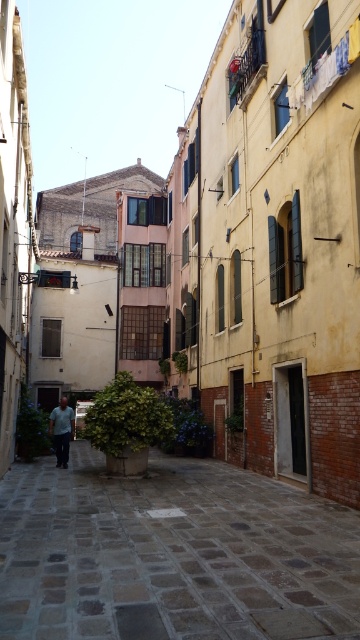
Question: Is stone paved path at center closer to camera compared to light green shirt at center?

Choices:
 (A) yes
 (B) no

Answer: (A)

Question: Which object appears closest to the camera in this image?

Choices:
 (A) stone paved path at center
 (B) light green shirt at center

Answer: (A)

Question: Which point is farther to the camera?

Choices:
 (A) light green shirt at center
 (B) stone paved path at center

Answer: (A)

Question: Is stone paved path at center bigger than light green shirt at center?

Choices:
 (A) no
 (B) yes

Answer: (A)

Question: Does stone paved path at center appear over light green shirt at center?

Choices:
 (A) yes
 (B) no

Answer: (A)